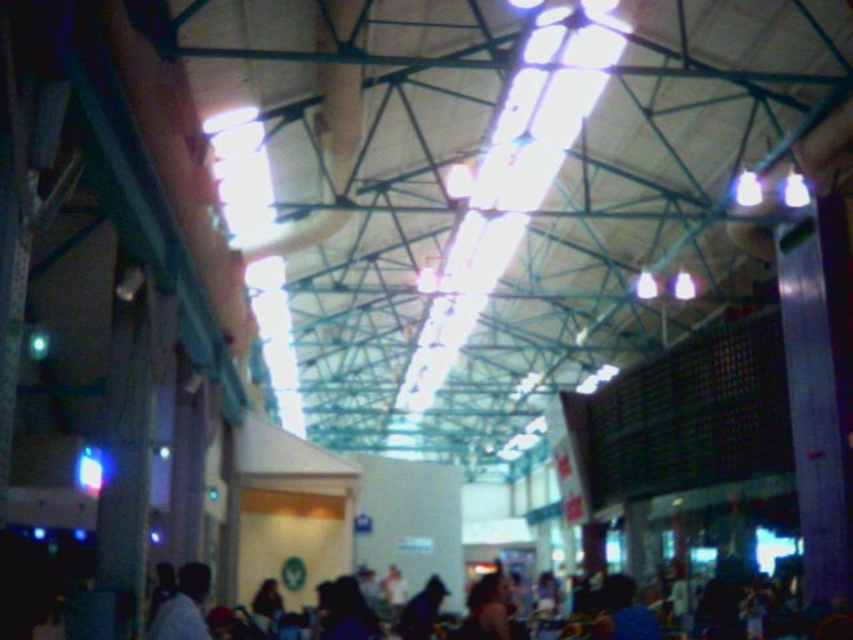
Question: Which object is closer to the camera taking this photo?

Choices:
 (A) dark brown hair at lower center
 (B) blue fabric shirt at lower left

Answer: (B)

Question: From the image, what is the correct spatial relationship of blue fabric shirt at lower left in relation to dark brown hair at lower center?

Choices:
 (A) left
 (B) right

Answer: (A)

Question: From the image, what is the correct spatial relationship of blue fabric shirt at lower left in relation to dark brown hair at lower center?

Choices:
 (A) below
 (B) above

Answer: (B)

Question: Is blue fabric shirt at lower left to the right of dark brown hair at lower center from the viewer's perspective?

Choices:
 (A) yes
 (B) no

Answer: (B)